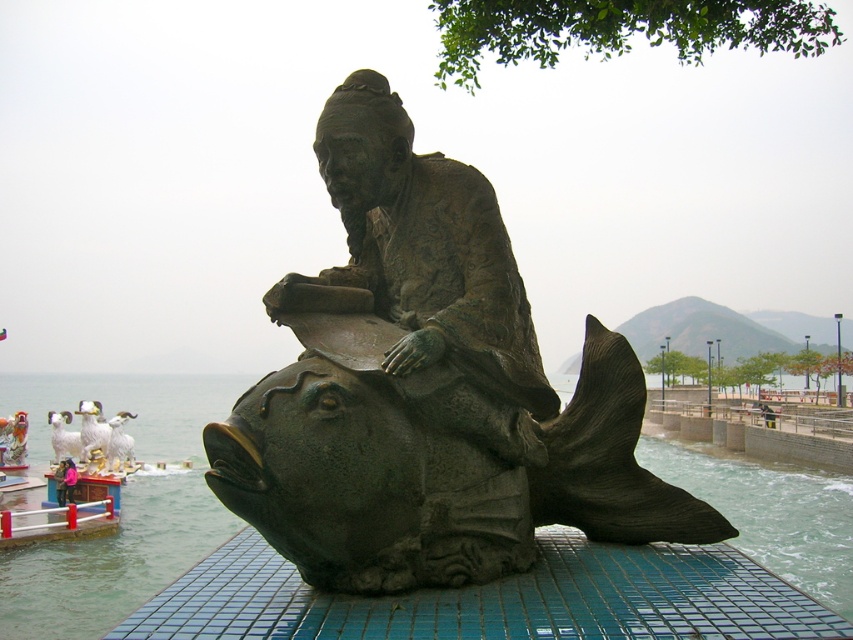
You are a tourist standing in front of the bronze statue at center and the bronze fish sculpture at center. Which one is positioned higher from the ground?

The bronze statue at center is located above the bronze fish sculpture at center, so the bronze statue at center is positioned higher from the ground.

You are a tour guide explaining the statue and its base to visitors. You want to mention the distance between the bronze statue at center and the bronze fish sculpture at center. How far apart are they?

The bronze statue at center is 6.71 meters away from the bronze fish sculpture at center.

You are standing in front of the bronze statue near the water. There are two points marked on the statue. The first point is at coordinate point (309,563) and the second point is at coordinate point (160,384). Which point is closer to you?

Point (309,563) is closer to the camera than point (160,384), so the first point is closer to you.